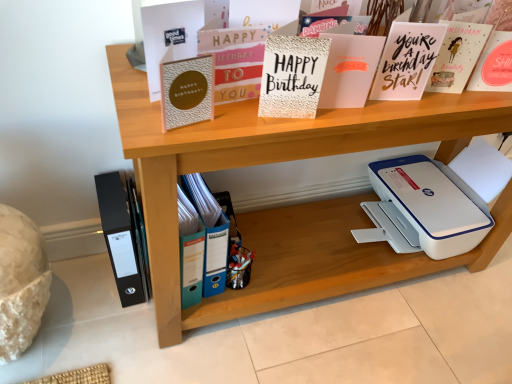
Question: Can you confirm if black matte folder at lower left is thinner than matte gold card at center, which is the 3th paperback book in right-to-left order?

Choices:
 (A) no
 (B) yes

Answer: (A)

Question: From a real-world perspective, does black matte folder at lower left sit lower than matte gold card at center, which is the 3th paperback book in right-to-left order?

Choices:
 (A) yes
 (B) no

Answer: (A)

Question: From a real-world perspective, is black matte folder at lower left over matte gold card at center, marked as the fifth paperback book in a left-to-right arrangement?

Choices:
 (A) no
 (B) yes

Answer: (A)

Question: From the image's perspective, is black matte folder at lower left on matte gold card at center, marked as the fifth paperback book in a left-to-right arrangement?

Choices:
 (A) yes
 (B) no

Answer: (B)

Question: Is black matte folder at lower left turned away from matte gold card at center, marked as the fifth paperback book in a left-to-right arrangement?

Choices:
 (A) no
 (B) yes

Answer: (A)

Question: Is black matte folder at lower left oriented towards matte gold card at center, marked as the fifth paperback book in a left-to-right arrangement?

Choices:
 (A) yes
 (B) no

Answer: (B)

Question: Can you confirm if white plastic printer at lower right is positioned to the right of matte gold card at upper center, which appears as the 6th paperback book when viewed from the left?

Choices:
 (A) yes
 (B) no

Answer: (A)

Question: Does white plastic printer at lower right have a lesser height compared to matte gold card at upper center, the 2th paperback book viewed from the right?

Choices:
 (A) yes
 (B) no

Answer: (B)

Question: Does white plastic printer at lower right turn towards matte gold card at upper center, the 2th paperback book viewed from the right?

Choices:
 (A) yes
 (B) no

Answer: (B)

Question: Can you confirm if white plastic printer at lower right is taller than matte gold card at upper center, which appears as the 6th paperback book when viewed from the left?

Choices:
 (A) yes
 (B) no

Answer: (A)

Question: From a real-world perspective, is white plastic printer at lower right under matte gold card at upper center, the 2th paperback book viewed from the right?

Choices:
 (A) no
 (B) yes

Answer: (B)

Question: From the image's perspective, is white plastic printer at lower right beneath matte gold card at upper center, which appears as the 6th paperback book when viewed from the left?

Choices:
 (A) yes
 (B) no

Answer: (A)

Question: From a real-world perspective, is textured gold card at center, which ranks as the fourth paperback book in left-to-right order, under matte pink card at upper right, positioned as the seventh paperback book in left-to-right order?

Choices:
 (A) yes
 (B) no

Answer: (B)